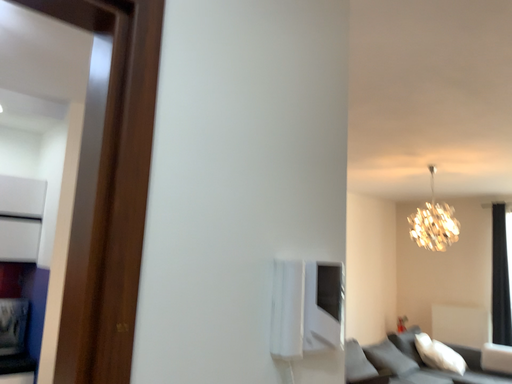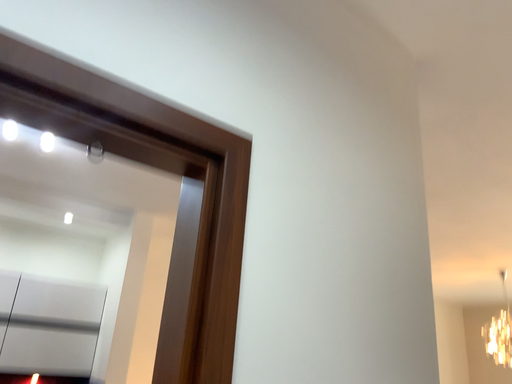
Question: How did the camera likely rotate when shooting the video?

Choices:
 (A) rotated downward
 (B) rotated upward

Answer: (B)